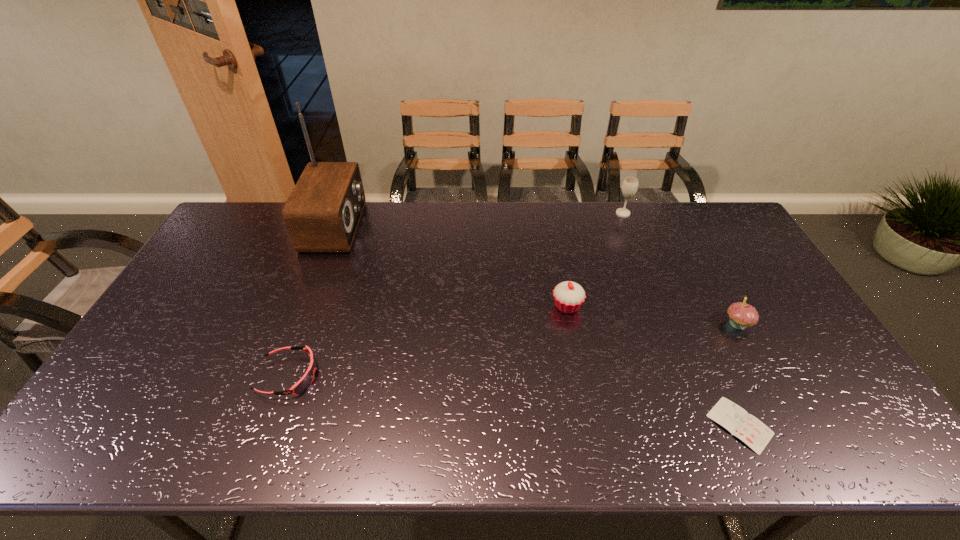
Locate an element on the screen. This screenshot has width=960, height=540. the tallest object is located at coordinates (322, 213).

Identify the location of wineglass. This screenshot has width=960, height=540. click(630, 185).

The width and height of the screenshot is (960, 540). What are the coordinates of `the right cupcake` in the screenshot? It's located at (741, 315).

Where is `the left cupcake`? The width and height of the screenshot is (960, 540). the left cupcake is located at coordinates (569, 296).

Locate an element on the screen. goggles is located at coordinates (307, 379).

Image resolution: width=960 pixels, height=540 pixels. I want to click on diary, so click(755, 434).

Identify the location of free space located 0.380m on the front-facing side of the tallest object. This screenshot has width=960, height=540. (468, 226).

In order to click on free space located on the front of the wineglass in this screenshot , I will do `click(636, 245)`.

Where is `free space located 0.120m on the right of the rightmost object`? This screenshot has width=960, height=540. free space located 0.120m on the right of the rightmost object is located at coordinates (793, 323).

Locate an element on the screen. This screenshot has height=540, width=960. vacant space situated on the back of the left cupcake is located at coordinates (558, 258).